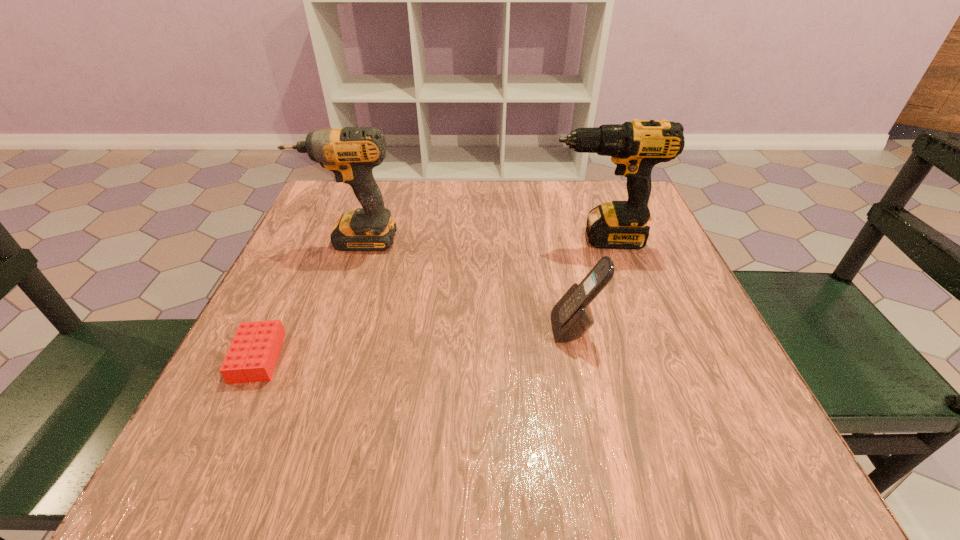
Find the location of a particular element. Image resolution: width=960 pixels, height=540 pixels. blank space at the far left corner of the desktop is located at coordinates (323, 215).

The image size is (960, 540). In order to click on vacant area at the near left corner in this screenshot , I will do `click(268, 472)`.

At what (x,y) coordinates should I click in order to perform the action: click on vacant space at the far right corner of the desktop. Please return your answer as a coordinate pair (x, y). The width and height of the screenshot is (960, 540). Looking at the image, I should click on (654, 222).

Locate an element on the screen. This screenshot has width=960, height=540. free region at the near right corner of the desktop is located at coordinates (665, 459).

Where is `vacant area that lies between the cellular telephone and the left drill`? vacant area that lies between the cellular telephone and the left drill is located at coordinates (464, 284).

Identify the location of empty space between the Lego and the cellular telephone. (417, 343).

Where is `empty location between the cellular telephone and the Lego`? This screenshot has height=540, width=960. empty location between the cellular telephone and the Lego is located at coordinates (417, 343).

You are a GUI agent. You are given a task and a screenshot of the screen. Output one action in this format:
    pyautogui.click(x=<x>, y=<y>)
    Task: Click on the unoccupied area between the right drill and the left drill
    The width and height of the screenshot is (960, 540).
    Given the screenshot: What is the action you would take?
    coord(475,239)

The width and height of the screenshot is (960, 540). I want to click on vacant area between the right drill and the left drill, so click(475, 239).

Identify the location of vacant point located between the Lego and the left drill. (305, 299).